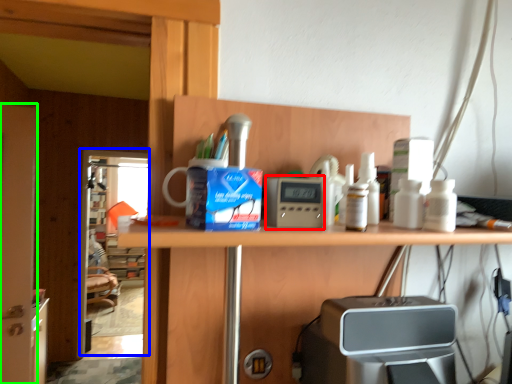
Question: Considering the real-world distances, which object is farthest from appliance (highlighted by a red box)? screen door (highlighted by a blue box) or screen door (highlighted by a green box)?

Choices:
 (A) screen door
 (B) screen door

Answer: (A)